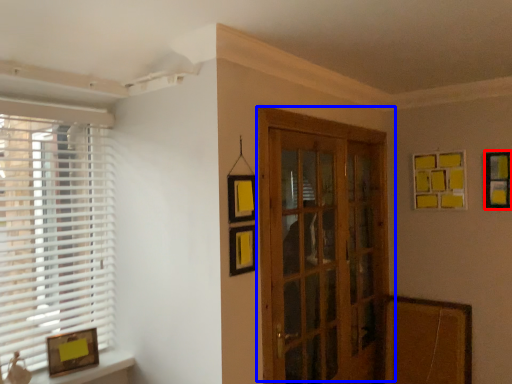
Question: Which object appears farthest to the camera in this image, picture frame (highlighted by a red box) or door (highlighted by a blue box)?

Choices:
 (A) picture frame
 (B) door

Answer: (A)